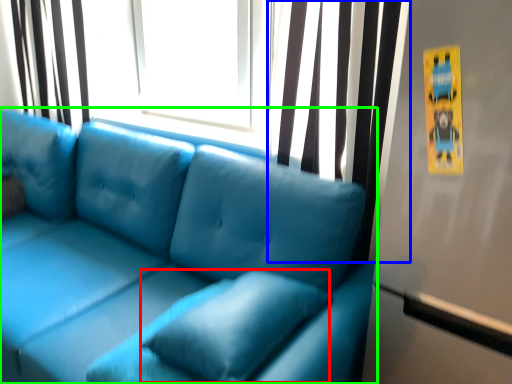
Question: Based on their relative distances, which object is nearer to pillow (highlighted by a red box)? Choose from curtain (highlighted by a blue box) and studio couch (highlighted by a green box).

Choices:
 (A) curtain
 (B) studio couch

Answer: (B)